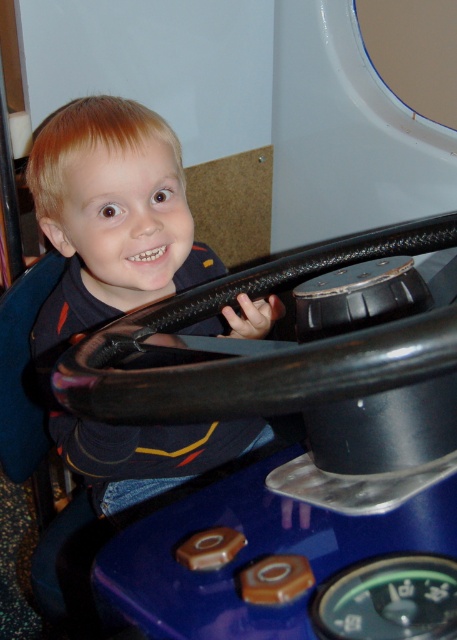
You are a child sitting inside the toy tractor and want to reach the black leather steering wheel at center. Based on its position, can you easily reach it from your seated position?

The black leather steering wheel at center is located at point (265, 356), which is within a typical reach distance for a child sitting in the tractor, so yes, it can be easily reached.